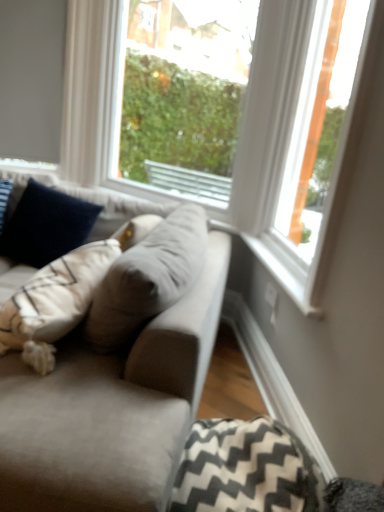
Question: Considering the positions of white wood frame at upper right, which is counted as the 2th window, starting from the left, and black-and-white zigzag fabric pillow at lower right, the first pillow viewed from the right, in the image, is white wood frame at upper right, which is counted as the 2th window, starting from the left, taller or shorter than black-and-white zigzag fabric pillow at lower right, the first pillow viewed from the right,?

Choices:
 (A) short
 (B) tall

Answer: (B)

Question: Is point (278, 103) closer or farther from the camera than point (253, 458)?

Choices:
 (A) farther
 (B) closer

Answer: (A)

Question: Which object is the closest to the suede gray couch at center?

Choices:
 (A) velvety navy blue pillow at left, the 1th pillow viewed from the top
 (B) white wood frame at upper right, acting as the first window starting from the right
 (C) transparent glass window at center, which is counted as the 2th window, starting from the right
 (D) black-and-white zigzag fabric pillow at lower right, which is the 1th pillow in bottom-to-top order

Answer: (D)

Question: Which of these objects is positioned farthest from the white wood frame at upper right, which is counted as the 2th window, starting from the left?

Choices:
 (A) velvety navy blue pillow at left, the second pillow in the right-to-left sequence
 (B) black-and-white zigzag fabric pillow at lower right, which appears as the first pillow when viewed from the front
 (C) transparent glass window at center, the first window in the left-to-right sequence
 (D) suede gray couch at center

Answer: (C)